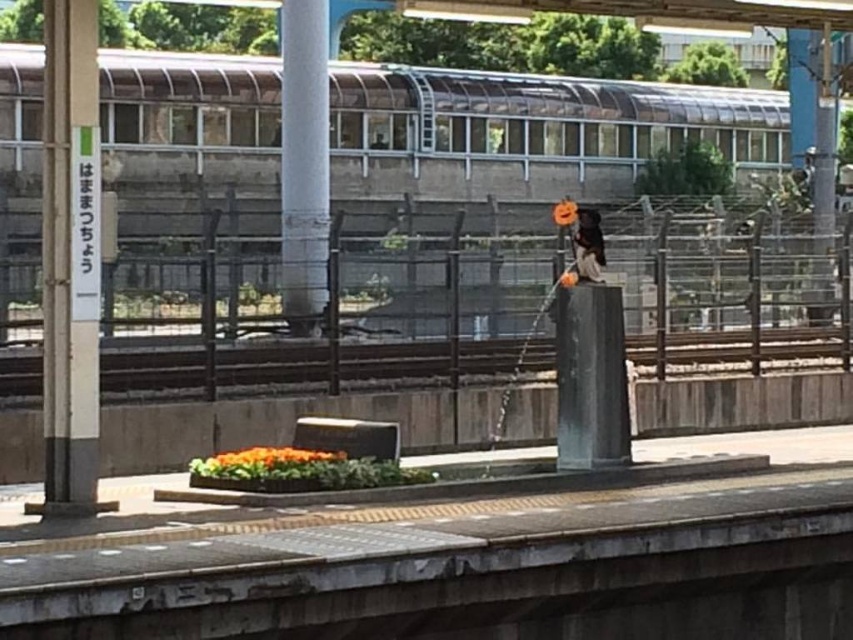
You are standing on the train station platform and see two points marked on the scene. The first point is at coordinates point (523,134) and the second point is at point (564,307). Which point is closer to you?

Point (523,134) is further to the camera than point (564,307), so the second point is closer to you.

You are standing at point (572, 442) and want to walk to point (300, 93). Is the destination point behind you or in front of you?

The destination point (300, 93) is behind point (572, 442), so it is behind you.

You are standing on the train station platform and need to locate the white painted metal pole at left and the smooth concrete pole at center. According to the scene, which pole is positioned to the right of the other?

The white painted metal pole at left is positioned to the right of the smooth concrete pole at center.